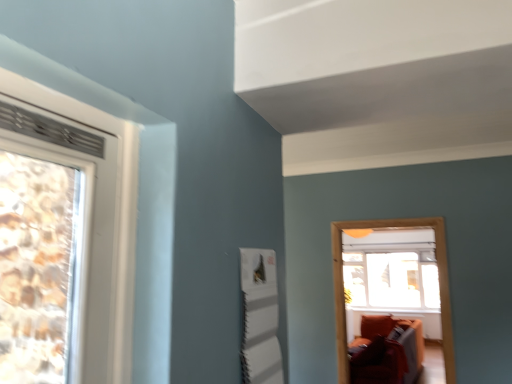
Question: From their relative heights in the image, would you say transparent glass window at center is taller or shorter than wooden frame at center?

Choices:
 (A) tall
 (B) short

Answer: (B)

Question: In the image, is transparent glass window at center positioned in front of or behind wooden frame at center?

Choices:
 (A) front
 (B) behind

Answer: (B)

Question: Considering the relative positions of transparent glass window at center and wooden frame at center in the image provided, is transparent glass window at center to the left or to the right of wooden frame at center?

Choices:
 (A) right
 (B) left

Answer: (A)

Question: From a real-world perspective, relative to transparent glass window at center, is wooden frame at center vertically above or below?

Choices:
 (A) above
 (B) below

Answer: (A)

Question: Visually, is wooden frame at center positioned to the left or to the right of transparent glass window at center?

Choices:
 (A) left
 (B) right

Answer: (A)

Question: Relative to transparent glass window at center, is wooden frame at center in front or behind?

Choices:
 (A) front
 (B) behind

Answer: (A)

Question: Based on their sizes in the image, would you say wooden frame at center is bigger or smaller than transparent glass window at center?

Choices:
 (A) small
 (B) big

Answer: (A)